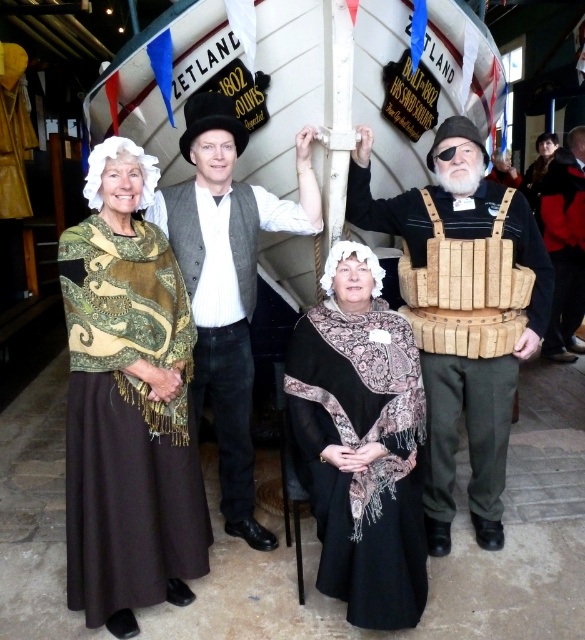
Who is lower down, black silk shawl at center or green patterned shawl at center?

black silk shawl at center is below.

Locate an element on the screen. The image size is (585, 640). black silk shawl at center is located at coordinates (360, 442).

Does point (314, 506) come behind point (548, 344)?

No.

Which is below, black silk shawl at center or red leather jacket at lower right?

black silk shawl at center is below.

Measure the distance between black silk shawl at center and camera.

They are 14.13 feet apart.

Identify the location of black silk shawl at center. This screenshot has height=640, width=585. (360, 442).

Does point (81, 353) come in front of point (469, 150)?

Yes, point (81, 353) is closer to viewer.

This screenshot has width=585, height=640. In order to click on brown woolen skirt at center in this screenshot , I will do `click(128, 403)`.